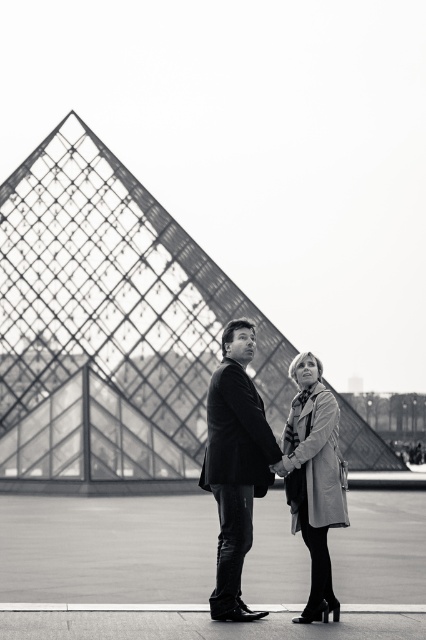
You are a tourist standing at the entrance of the Louvre Pyramid. You see the glass lattice pyramid at center and the matte black suit at center. Which object is closer to you?

The glass lattice pyramid at center is closer to you because the matte black suit at center is behind it.

You are a photographer planning to capture a wide shot of the glass lattice pyramid at center and the light gray wool coat at center in the image. Given that your camera can only focus on objects within a 50 cm width, will both objects fit within the frame?

The glass lattice pyramid at center is wider than the light gray wool coat at center. Since the camera can only focus on objects within 50 cm width, the glass lattice pyramid at center may exceed the frame, but the light gray wool coat at center might fit. However, without knowing the exact widths, it is uncertain.

You are standing at the entrance of the Louvre Pyramid. There is a point marked at coordinates (109,323). What object does this point correspond to in the scene?

The point at coordinates (109,323) corresponds to the glass lattice pyramid at center.